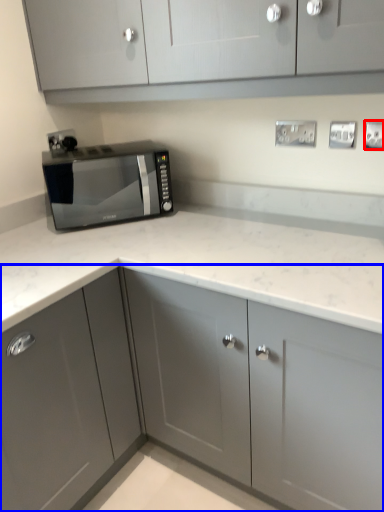
Question: Which point is further to the camera, electric outlet (highlighted by a red box) or cabinetry (highlighted by a blue box)?

Choices:
 (A) electric outlet
 (B) cabinetry

Answer: (A)